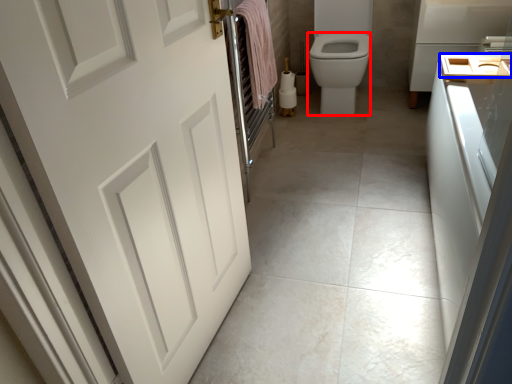
Question: Which object appears farthest to the camera in this image, bidet (highlighted by a red box) or sink (highlighted by a blue box)?

Choices:
 (A) bidet
 (B) sink

Answer: (A)